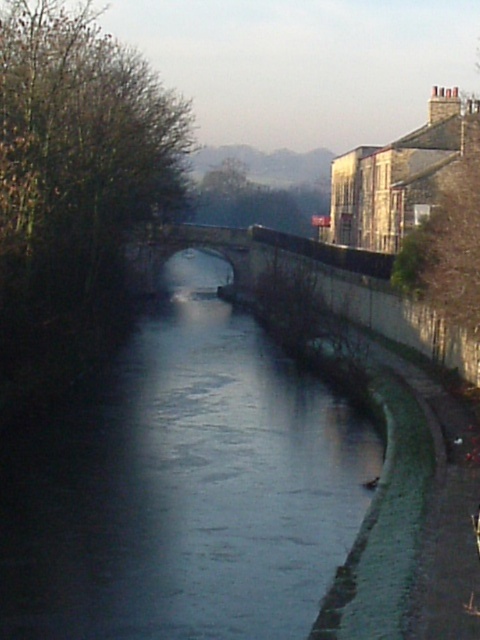
Who is positioned more to the left, smooth concrete river at center or stone arch bridge at center?

Positioned to the left is stone arch bridge at center.

Measure the distance between point (239, 337) and camera.

217.55 feet

The width and height of the screenshot is (480, 640). What are the coordinates of `smooth concrete river at center` in the screenshot? It's located at (182, 490).